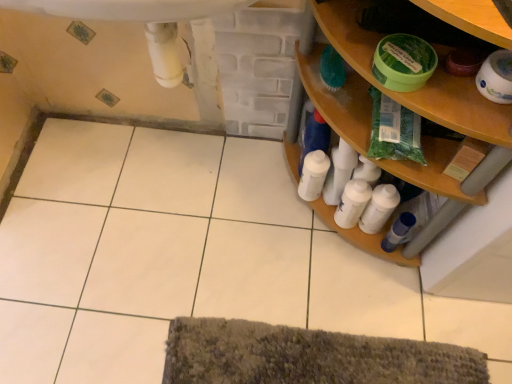
The height and width of the screenshot is (384, 512). Find the location of `vacant space to the left of blue glossy bottle at lower right, which appears as the first toiletry when viewed from the right`. vacant space to the left of blue glossy bottle at lower right, which appears as the first toiletry when viewed from the right is located at coordinates (329, 257).